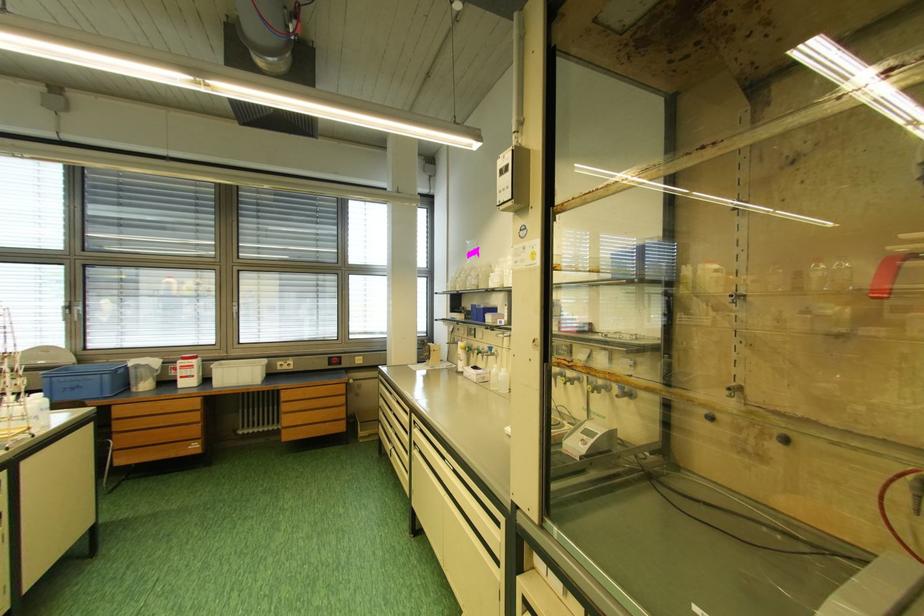
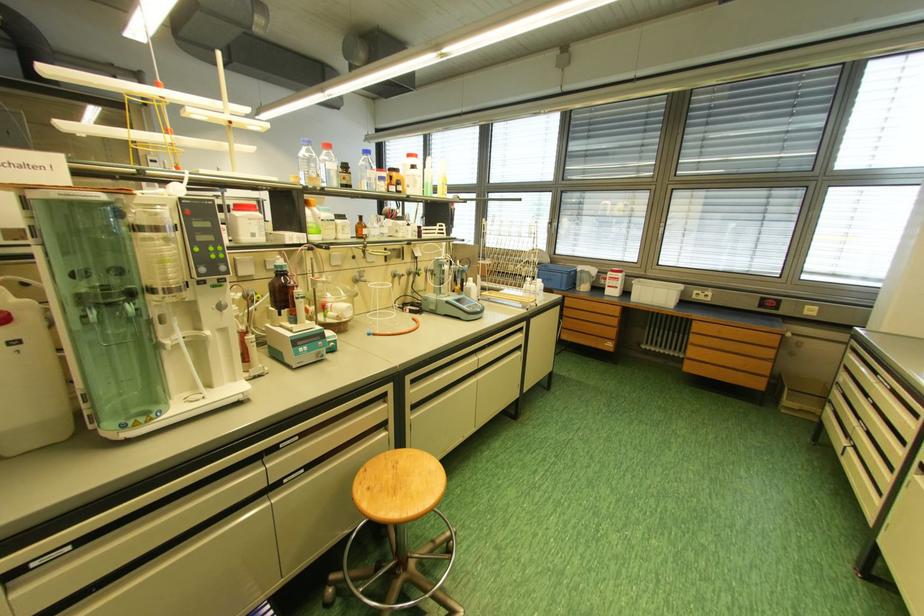
Question: The camera is either moving clockwise (left) or counter-clockwise (right) around the object. The first image is from the beginning of the video and the second image is from the end. Is the camera moving left or right when shooting the video?

Choices:
 (A) Left
 (B) Right

Answer: (B)